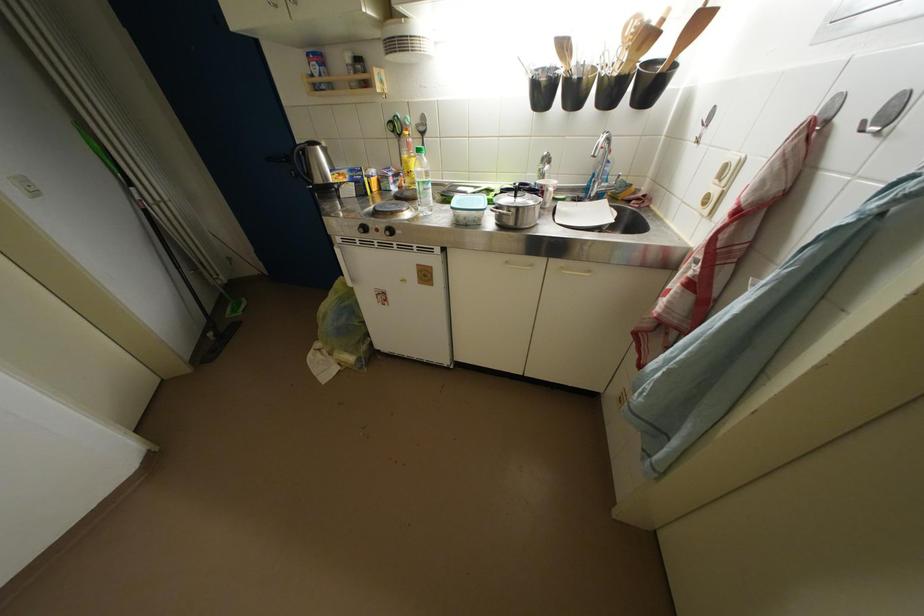
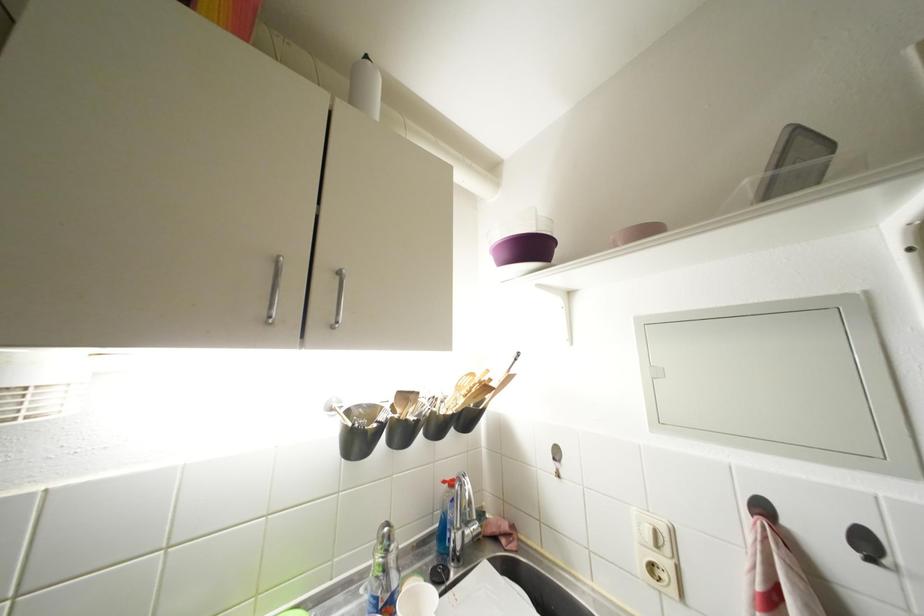
The point at (869,132) is marked in the first image. Where is the corresponding point in the second image?

(877, 565)